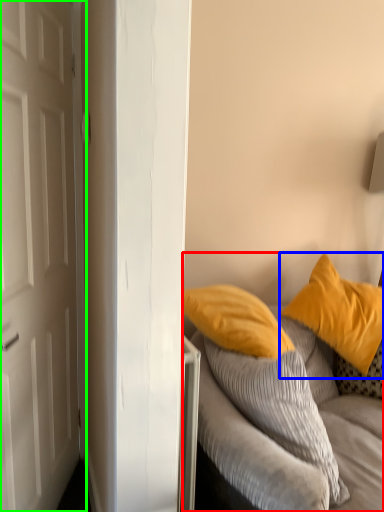
Question: Estimate the real-world distances between objects in this image. Which object is closer to studio couch (highlighted by a red box), pillow (highlighted by a blue box) or door (highlighted by a green box)?

Choices:
 (A) pillow
 (B) door

Answer: (A)